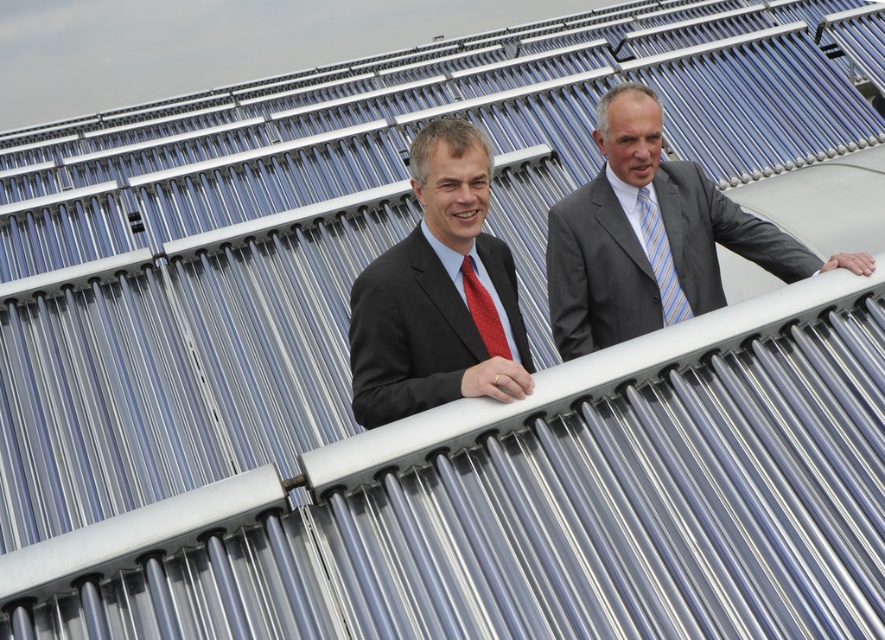
Question: Which object is closer to the camera taking this photo?

Choices:
 (A) matte black suit at center
 (B) gray suit at center
 (C) striped silk tie at center
 (D) red dotted fabric tie at center

Answer: (A)

Question: Can you confirm if gray suit at center is wider than matte black suit at center?

Choices:
 (A) yes
 (B) no

Answer: (A)

Question: Which object is closer to the camera taking this photo?

Choices:
 (A) red dotted fabric tie at center
 (B) gray suit at center
 (C) matte black suit at center

Answer: (C)

Question: Can you confirm if gray suit at center is thinner than matte black suit at center?

Choices:
 (A) yes
 (B) no

Answer: (B)

Question: Based on their relative distances, which object is nearer to the striped silk tie at center?

Choices:
 (A) gray suit at center
 (B) matte black suit at center

Answer: (A)

Question: Is matte black suit at center bigger than striped silk tie at center?

Choices:
 (A) no
 (B) yes

Answer: (B)